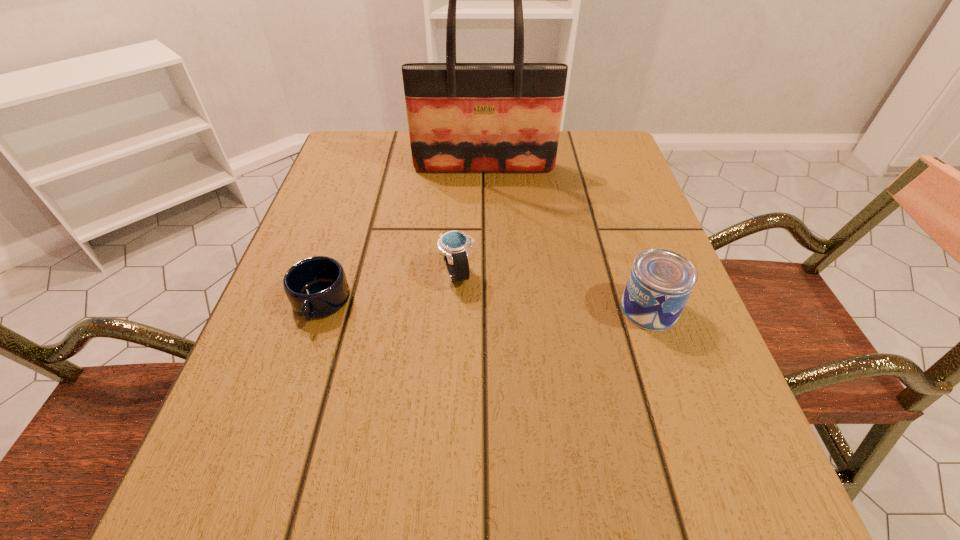
Find the location of a particular element. free space between the can and the mug is located at coordinates (485, 306).

The height and width of the screenshot is (540, 960). In order to click on free space that is in between the leftmost object and the rightmost object in this screenshot , I will do `click(485, 306)`.

Find the location of a particular element. The image size is (960, 540). vacant space in between the mug and the can is located at coordinates (485, 306).

This screenshot has height=540, width=960. In order to click on vacant area between the farthest object and the rightmost object in this screenshot , I will do tap(566, 238).

You are a GUI agent. You are given a task and a screenshot of the screen. Output one action in this format:
    pyautogui.click(x=<x>, y=<y>)
    Task: Click on the unoccupied position between the rightmost object and the watch
    The width and height of the screenshot is (960, 540).
    Given the screenshot: What is the action you would take?
    pyautogui.click(x=554, y=291)

This screenshot has width=960, height=540. Identify the location of free space between the can and the leftmost object. (485, 306).

At what (x,y) coordinates should I click in order to perform the action: click on blank region between the farthest object and the watch. Please return your answer as a coordinate pair (x, y). The width and height of the screenshot is (960, 540). Looking at the image, I should click on [x=470, y=220].

The image size is (960, 540). What are the coordinates of `free space that is in between the shortest object and the rightmost object` in the screenshot? It's located at (485, 306).

This screenshot has width=960, height=540. In order to click on vacant area between the rightmost object and the mug in this screenshot , I will do point(485,306).

Choose which object is the nearest neighbor to the watch. Please provide its 2D coordinates. Your answer should be formatted as a tuple, i.e. [(x, y)], where the tuple contains the x and y coordinates of a point satisfying the conditions above.

[(316, 287)]